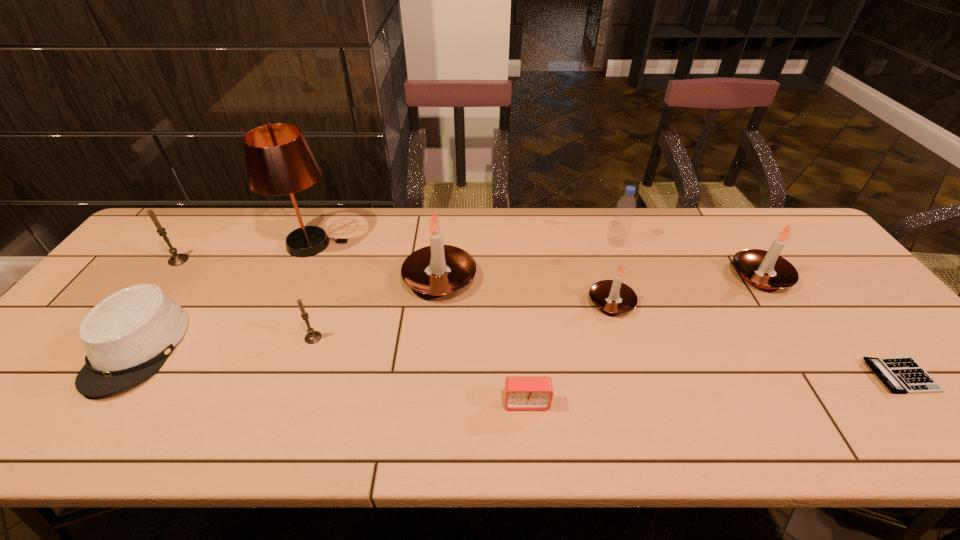
The image size is (960, 540). Find the location of `vacant space located on the left of the second smallest white candle`. vacant space located on the left of the second smallest white candle is located at coordinates (598, 276).

Image resolution: width=960 pixels, height=540 pixels. I want to click on free space located 0.370m on the right of the leftmost candle, so (x=313, y=260).

Where is `free space located 0.100m on the back of the second white candle from left to right`? This screenshot has height=540, width=960. free space located 0.100m on the back of the second white candle from left to right is located at coordinates (600, 262).

Where is `free space located 0.080m on the right of the nearest candle`? free space located 0.080m on the right of the nearest candle is located at coordinates (354, 338).

This screenshot has height=540, width=960. I want to click on vacant space located on the front-facing side of the second shortest object, so click(530, 443).

The width and height of the screenshot is (960, 540). Identify the location of free space located on the left of the shortest object. (783, 376).

Locate an element on the screen. Image resolution: width=960 pixels, height=540 pixels. lampshade that is at the far edge is located at coordinates (279, 161).

Image resolution: width=960 pixels, height=540 pixels. In order to click on bottle that is at the far edge in this screenshot , I will do `click(621, 224)`.

At what (x,y) coordinates should I click in order to perform the action: click on object located at the near edge. Please return your answer as a coordinate pair (x, y). This screenshot has width=960, height=540. Looking at the image, I should click on (521, 392).

Find the location of a particular element. This screenshot has height=540, width=960. candle at the left edge is located at coordinates (177, 259).